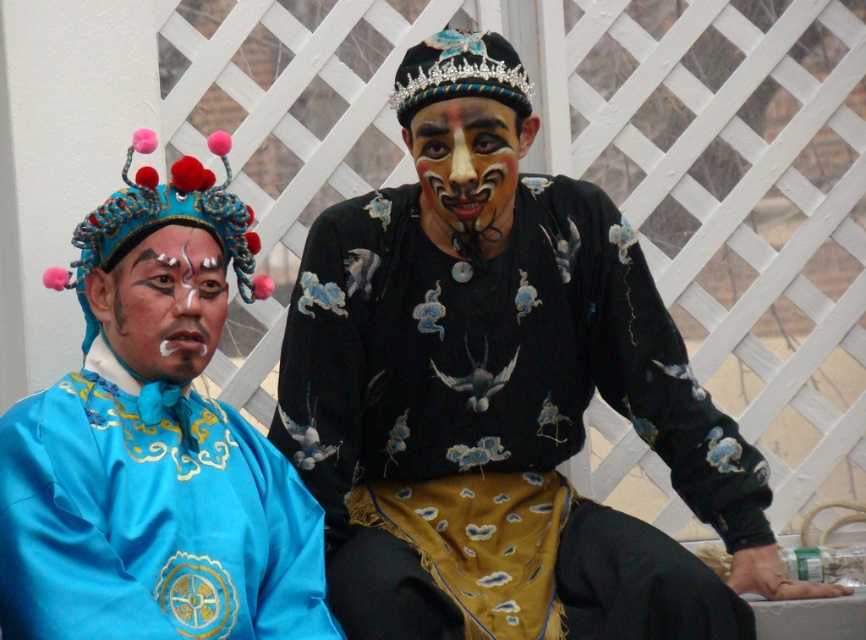
You are a photographer positioned in front of the two performers. You want to take a photo focusing on the black satin embroidered shirt at center without the satin blue robe at left overlapping it. Is this possible based on their current positions?

Yes, because the black satin embroidered shirt at center is closer to the viewer than the satin blue robe at left, so the black satin embroidered shirt at center will block the view of the satin blue robe at left, allowing you to focus on it without overlap.